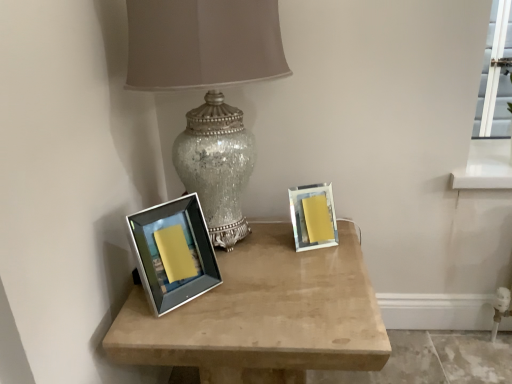
Question: Could you tell me if matte silver picture frame at right, the first picture frame viewed from the back, is facing satin silver frame at center?

Choices:
 (A) yes
 (B) no

Answer: (B)

Question: Is matte silver picture frame at right, which appears as the 2th picture frame when viewed from the left, taller than satin silver frame at center?

Choices:
 (A) no
 (B) yes

Answer: (A)

Question: Is matte silver picture frame at right, the 2th picture frame when ordered from front to back, bigger than satin silver frame at center?

Choices:
 (A) yes
 (B) no

Answer: (B)

Question: Is matte silver picture frame at right, positioned as the 1th picture frame in right-to-left order, at the left side of satin silver frame at center?

Choices:
 (A) no
 (B) yes

Answer: (A)

Question: Is matte silver picture frame at right, positioned as the 1th picture frame in right-to-left order, closer to the viewer compared to satin silver frame at center?

Choices:
 (A) yes
 (B) no

Answer: (B)

Question: Is crackle glass lamp at center taller or shorter than matte silver picture frame at right, the 2th picture frame when ordered from front to back?

Choices:
 (A) tall
 (B) short

Answer: (A)

Question: Looking at the image, does crackle glass lamp at center seem bigger or smaller compared to matte silver picture frame at right, positioned as the 1th picture frame in right-to-left order?

Choices:
 (A) small
 (B) big

Answer: (B)

Question: Which is correct: crackle glass lamp at center is inside matte silver picture frame at right, the 2th picture frame when ordered from front to back, or outside of it?

Choices:
 (A) outside
 (B) inside

Answer: (A)

Question: From the image's perspective, relative to matte silver picture frame at right, the first picture frame viewed from the back, is crackle glass lamp at center above or below?

Choices:
 (A) below
 (B) above

Answer: (B)

Question: Is silver/metallic picture frame at left, arranged as the 1th picture frame when viewed from the left, taller or shorter than satin silver frame at center?

Choices:
 (A) tall
 (B) short

Answer: (B)

Question: Visually, is silver/metallic picture frame at left, the second picture frame viewed from the back, positioned to the left or to the right of satin silver frame at center?

Choices:
 (A) left
 (B) right

Answer: (A)

Question: From a real-world perspective, relative to satin silver frame at center, is silver/metallic picture frame at left, the first picture frame viewed from the front, vertically above or below?

Choices:
 (A) above
 (B) below

Answer: (A)

Question: Is silver/metallic picture frame at left, the second picture frame viewed from the back, inside or outside of satin silver frame at center?

Choices:
 (A) outside
 (B) inside

Answer: (A)

Question: Is silver/metallic picture frame at left, the first picture frame viewed from the front, inside the boundaries of matte silver picture frame at right, the first picture frame viewed from the back, or outside?

Choices:
 (A) inside
 (B) outside

Answer: (B)

Question: From a real-world perspective, is silver/metallic picture frame at left, the first picture frame viewed from the front, physically located above or below matte silver picture frame at right, positioned as the 1th picture frame in right-to-left order?

Choices:
 (A) above
 (B) below

Answer: (A)